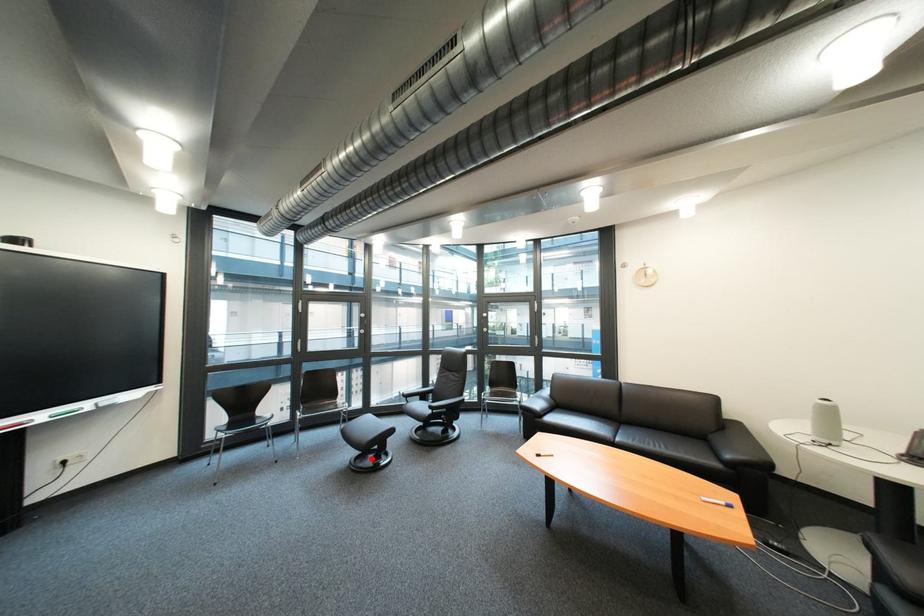
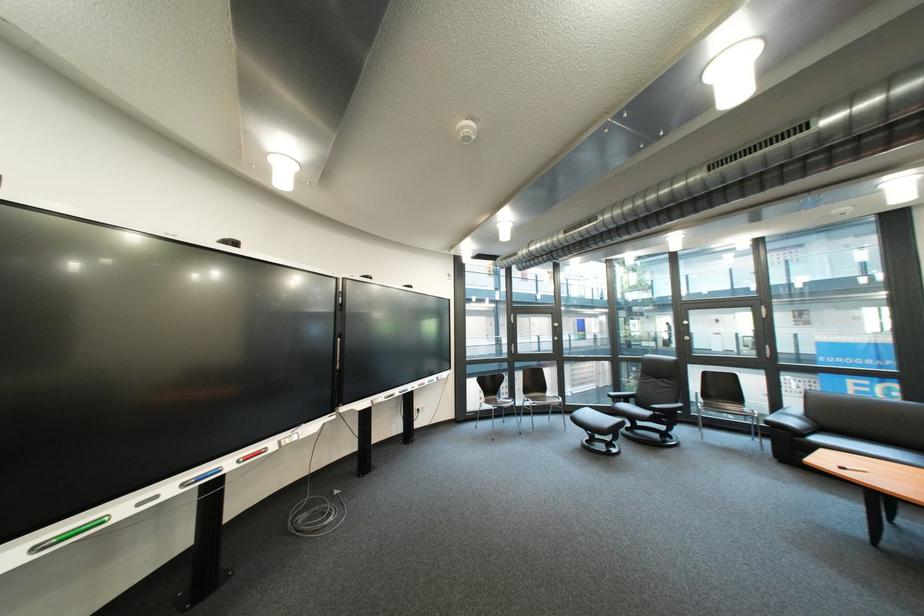
Question: I am providing you with two images of the same scene from different viewpoints. Image1 has a red point marked. In image2, the corresponding 3D location appears at what relative position? Reply with the corresponding letter.

Choices:
 (A) Closer
 (B) Farther

Answer: (A)